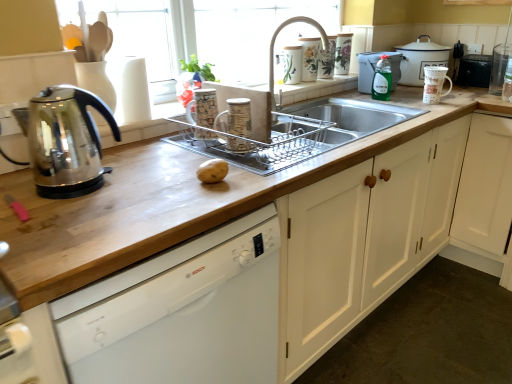
This screenshot has height=384, width=512. In order to click on vacant space behind brown matte potato at center in this screenshot , I will do `click(221, 157)`.